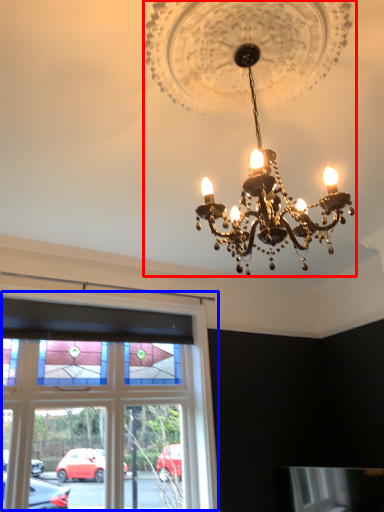
Question: Which object is closer to the camera taking this photo, lamp (highlighted by a red box) or window (highlighted by a blue box)?

Choices:
 (A) lamp
 (B) window

Answer: (A)